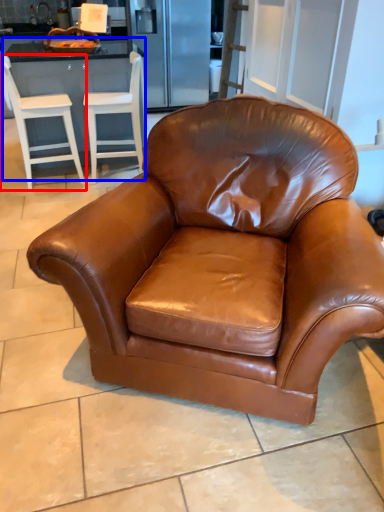
Question: Among these objects, which one is nearest to the camera, chair (highlighted by a red box) or dresser (highlighted by a blue box)?

Choices:
 (A) chair
 (B) dresser

Answer: (A)